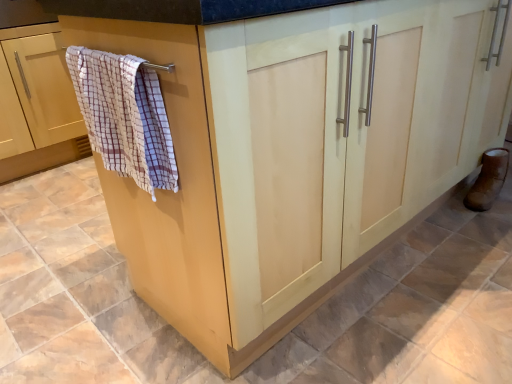
The width and height of the screenshot is (512, 384). Identify the location of blank space to the left of brown leather boot at lower right. (448, 209).